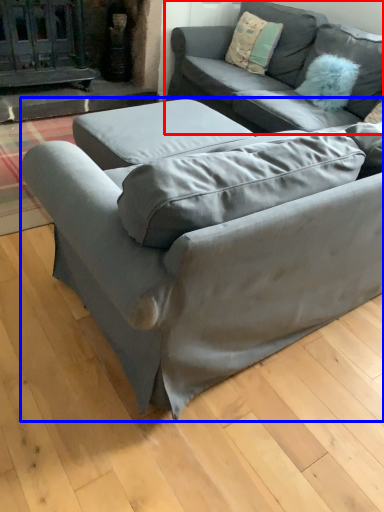
Question: Which of the following is the closest to the observer, studio couch (highlighted by a red box) or studio couch (highlighted by a blue box)?

Choices:
 (A) studio couch
 (B) studio couch

Answer: (B)